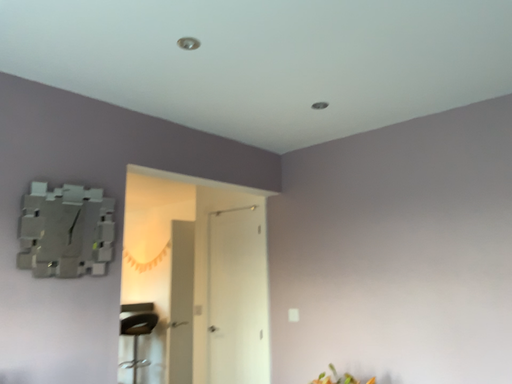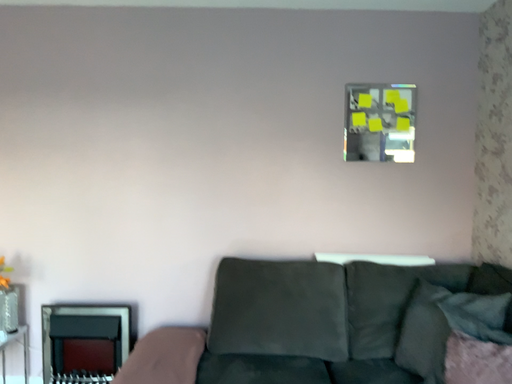
Question: How did the camera likely rotate when shooting the video?

Choices:
 (A) rotated upward
 (B) rotated downward

Answer: (B)